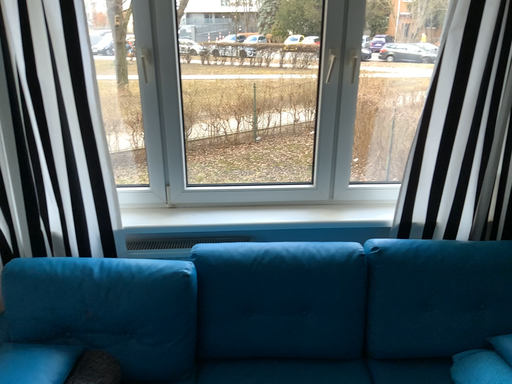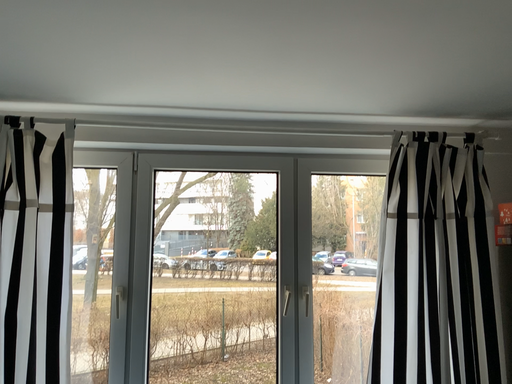
Question: Which way did the camera rotate in the video?

Choices:
 (A) rotated downward
 (B) rotated upward

Answer: (B)